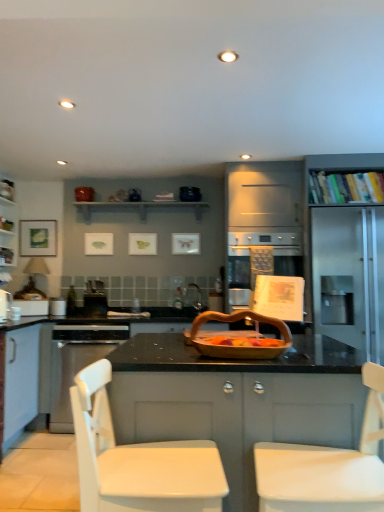
Question: Can matte black shelf at upper center, the first shelf viewed from the left, be found inside metallic silver toaster at left, which is counted as the 1th appliance, starting from the left?

Choices:
 (A) yes
 (B) no

Answer: (B)

Question: Does metallic silver toaster at left, which is counted as the 1th appliance, starting from the left, come in front of matte black shelf at upper center, the first shelf viewed from the left?

Choices:
 (A) yes
 (B) no

Answer: (A)

Question: Can you confirm if metallic silver toaster at left, which ranks as the 1th appliance in front-to-back order, is positioned to the right of matte black shelf at upper center, the second shelf from the front?

Choices:
 (A) yes
 (B) no

Answer: (B)

Question: Is metallic silver toaster at left, which is counted as the 1th appliance, starting from the left, further to camera compared to matte black shelf at upper center, the first shelf viewed from the left?

Choices:
 (A) no
 (B) yes

Answer: (A)

Question: From a real-world perspective, does metallic silver toaster at left, which is counted as the 1th appliance, starting from the left, sit lower than matte black shelf at upper center, placed as the second shelf when sorted from right to left?

Choices:
 (A) no
 (B) yes

Answer: (B)

Question: From the image's perspective, relative to white glossy cabinet at left, the 1th cabinetry from the back, is matte black shelf at upper center, placed as the second shelf when sorted from right to left, above or below?

Choices:
 (A) above
 (B) below

Answer: (A)

Question: Based on their sizes in the image, would you say matte black shelf at upper center, the 1th shelf viewed from the back, is bigger or smaller than white glossy cabinet at left, placed as the 1th cabinetry when sorted from top to bottom?

Choices:
 (A) big
 (B) small

Answer: (A)

Question: Considering their positions, is matte black shelf at upper center, placed as the second shelf when sorted from right to left, located in front of or behind white glossy cabinet at left, the second cabinetry when ordered from front to back?

Choices:
 (A) behind
 (B) front

Answer: (A)

Question: Is point (87, 212) closer or farther from the camera than point (13, 260)?

Choices:
 (A) closer
 (B) farther

Answer: (B)

Question: Is white matte cabinet at center, positioned as the 1th cabinetry in front-to-back order, inside or outside of hardcover books at upper right, which is counted as the 1th shelf, starting from the right?

Choices:
 (A) outside
 (B) inside

Answer: (A)

Question: From their relative heights in the image, would you say white matte cabinet at center, the second cabinetry positioned from the back, is taller or shorter than hardcover books at upper right, positioned as the 2th shelf in back-to-front order?

Choices:
 (A) tall
 (B) short

Answer: (A)

Question: Does point 334,371 appear closer or farther from the camera than point 322,199?

Choices:
 (A) farther
 (B) closer

Answer: (B)

Question: Is white matte cabinet at center, positioned as the 1th cabinetry in front-to-back order, bigger or smaller than hardcover books at upper right, which is counted as the 1th shelf, starting from the right?

Choices:
 (A) big
 (B) small

Answer: (A)

Question: From a real-world perspective, relative to white glossy cabinet at left, placed as the first cabinetry when sorted from left to right, is wooden basket at center vertically above or below?

Choices:
 (A) above
 (B) below

Answer: (B)

Question: Does point (281, 327) appear closer or farther from the camera than point (6, 256)?

Choices:
 (A) closer
 (B) farther

Answer: (A)